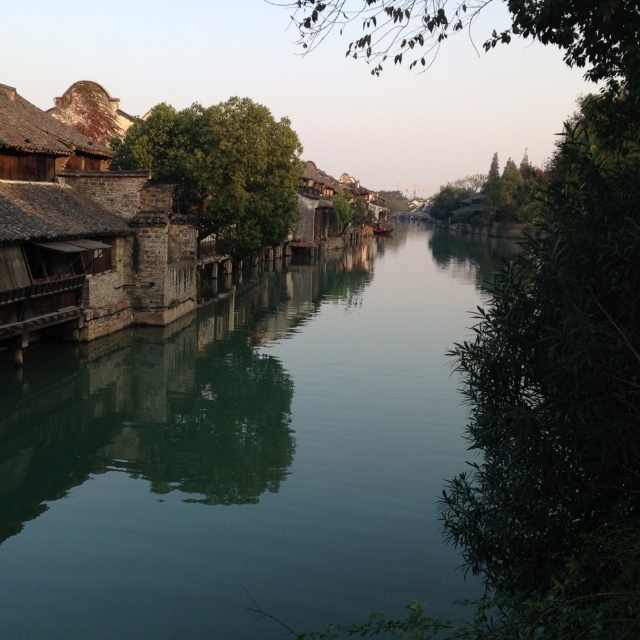
Question: Does green reflective water at center have a lesser width compared to green leafy tree at upper right?

Choices:
 (A) yes
 (B) no

Answer: (B)

Question: Which point is farther to the camera?

Choices:
 (A) green reflective water at center
 (B) rusty metal roof at upper left

Answer: (B)

Question: Based on their relative distances, which object is nearer to the green leafy tree at upper right?

Choices:
 (A) green leafy tree at center right
 (B) rusty metal roof at upper left

Answer: (A)

Question: Can you confirm if green leafy tree at center right is positioned above rusty metal roof at upper left?

Choices:
 (A) yes
 (B) no

Answer: (A)

Question: Which of the following is the closest to the observer?

Choices:
 (A) green leafy tree at center right
 (B) green leafy tree at upper right
 (C) rusty metal roof at upper left

Answer: (A)

Question: Does green reflective water at center appear on the left side of green leafy tree at upper right?

Choices:
 (A) no
 (B) yes

Answer: (B)